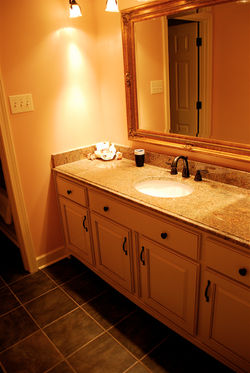
The width and height of the screenshot is (250, 373). I want to click on cup, so click(136, 158).